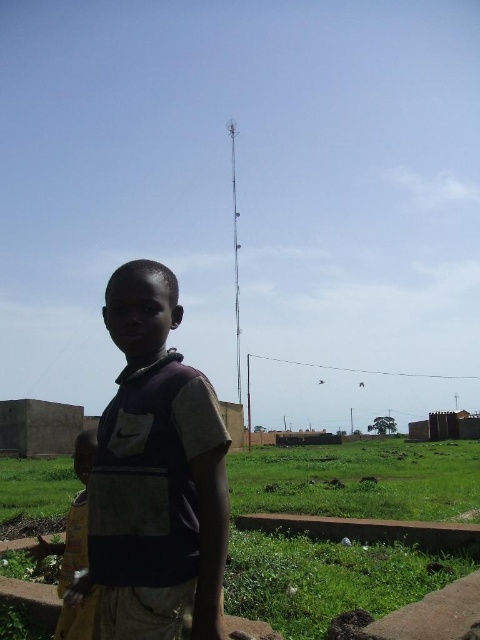
Which is behind, point (171, 369) or point (81, 461)?

Positioned behind is point (81, 461).

Identify the location of dark purple shirt at center. (156, 476).

Where is `dark purple shirt at center`? This screenshot has height=640, width=480. dark purple shirt at center is located at coordinates coord(156,476).